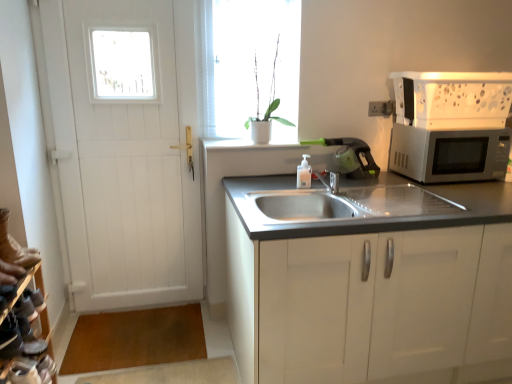
Question: Are white smooth window sill at upper center and silver metallic microwave at right located far from each other?

Choices:
 (A) yes
 (B) no

Answer: (B)

Question: Considering the relative sizes of white smooth window sill at upper center and silver metallic microwave at right in the image provided, is white smooth window sill at upper center thinner than silver metallic microwave at right?

Choices:
 (A) no
 (B) yes

Answer: (B)

Question: Does white smooth window sill at upper center come in front of silver metallic microwave at right?

Choices:
 (A) yes
 (B) no

Answer: (B)

Question: Considering the relative positions of white smooth window sill at upper center and silver metallic microwave at right in the image provided, is white smooth window sill at upper center to the left of silver metallic microwave at right from the viewer's perspective?

Choices:
 (A) no
 (B) yes

Answer: (B)

Question: Is white smooth window sill at upper center shorter than silver metallic microwave at right?

Choices:
 (A) no
 (B) yes

Answer: (B)

Question: Considering the positions of white matte plant at upper center and white smooth window sill at upper center in the image, is white matte plant at upper center bigger or smaller than white smooth window sill at upper center?

Choices:
 (A) small
 (B) big

Answer: (B)

Question: From a real-world perspective, is white matte plant at upper center positioned above or below white smooth window sill at upper center?

Choices:
 (A) above
 (B) below

Answer: (A)

Question: Relative to white smooth window sill at upper center, is white matte plant at upper center in front or behind?

Choices:
 (A) behind
 (B) front

Answer: (A)

Question: From the image's perspective, is white matte plant at upper center above or below white smooth window sill at upper center?

Choices:
 (A) above
 (B) below

Answer: (A)

Question: Considering their positions, is silver metallic microwave at right located in front of or behind white matte plant at upper center?

Choices:
 (A) behind
 (B) front

Answer: (B)

Question: From a real-world perspective, is silver metallic microwave at right above or below white matte plant at upper center?

Choices:
 (A) above
 (B) below

Answer: (B)

Question: Looking at their shapes, would you say silver metallic microwave at right is wider or thinner than white matte plant at upper center?

Choices:
 (A) wide
 (B) thin

Answer: (A)

Question: Is silver metallic microwave at right taller or shorter than white matte plant at upper center?

Choices:
 (A) short
 (B) tall

Answer: (A)

Question: Based on their sizes in the image, would you say white smooth window sill at upper center is bigger or smaller than leather shoe at lower left?

Choices:
 (A) big
 (B) small

Answer: (A)

Question: Which is correct: white smooth window sill at upper center is inside leather shoe at lower left, or outside of it?

Choices:
 (A) outside
 (B) inside

Answer: (A)